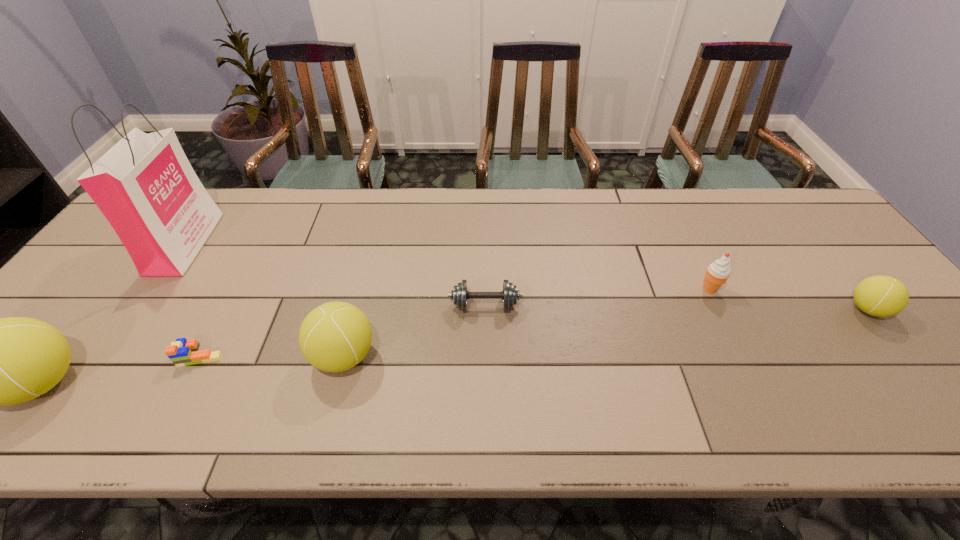
Where is `the third object from left to right`? The image size is (960, 540). the third object from left to right is located at coordinates (182, 352).

Find the location of `Lego`. Lego is located at coordinates (182, 352).

At what (x,y) coordinates should I click in order to perform the action: click on free region located 0.130m on the left of the second tennis ball from left to right. Please return your answer as a coordinate pair (x, y). The height and width of the screenshot is (540, 960). Looking at the image, I should click on (253, 356).

Locate an element on the screen. vacant region located on the front of the farthest tennis ball is located at coordinates (894, 342).

In order to click on vacant space located on the front-facing side of the farthest object in this screenshot , I will do `click(278, 244)`.

Locate an element on the screen. The width and height of the screenshot is (960, 540). free location located 0.240m on the back of the dumbbell is located at coordinates (484, 233).

Where is `vacant space located 0.310m on the back of the second object from right to left`? This screenshot has width=960, height=540. vacant space located 0.310m on the back of the second object from right to left is located at coordinates (670, 210).

At what (x,y) coordinates should I click in order to perform the action: click on vacant region located on the left of the shortest object. Please return your answer as a coordinate pair (x, y). Looking at the image, I should click on click(24, 356).

I want to click on object present at the far edge, so click(x=145, y=186).

Where is `tennis ball located in the near edge section of the desktop`? The width and height of the screenshot is (960, 540). tennis ball located in the near edge section of the desktop is located at coordinates (334, 337).